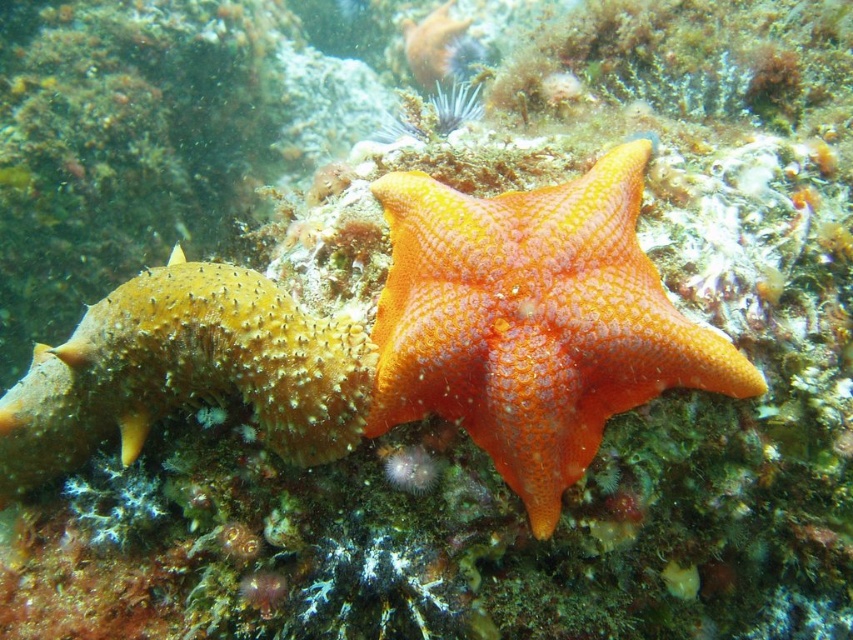
Does orange rough starfish at center have a greater width compared to spongy orange starfish at center?

No, orange rough starfish at center is not wider than spongy orange starfish at center.

Is point (618, 148) positioned before point (90, 401)?

No, (618, 148) is behind (90, 401).

The width and height of the screenshot is (853, 640). What do you see at coordinates (532, 321) in the screenshot? I see `orange rough starfish at center` at bounding box center [532, 321].

At what (x,y) coordinates should I click in order to perform the action: click on orange rough starfish at center. Please return your answer as a coordinate pair (x, y). This screenshot has width=853, height=640. Looking at the image, I should click on (532, 321).